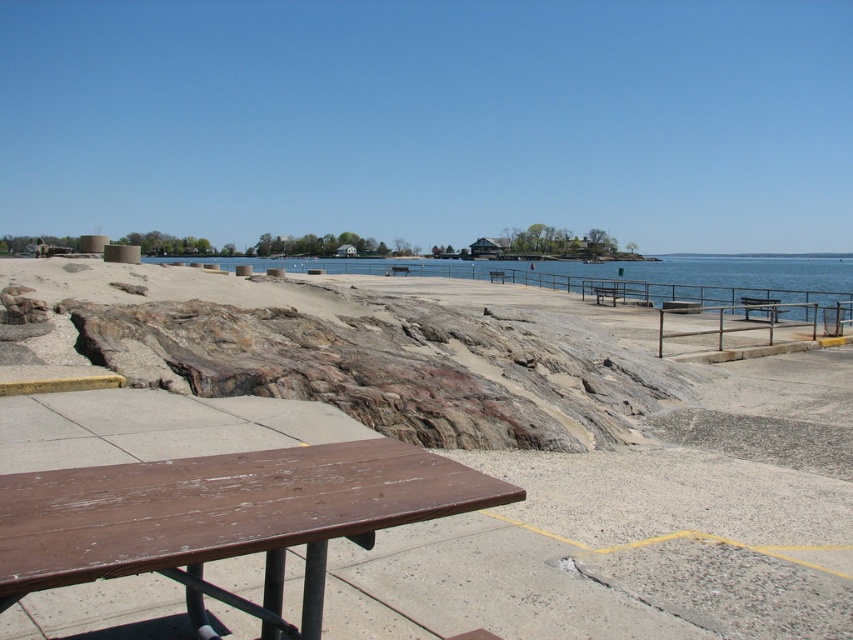
Does wooden picnic table at lower left have a greater width compared to blue water at center?

No.

Does wooden picnic table at lower left appear on the left side of blue water at center?

Indeed, wooden picnic table at lower left is positioned on the left side of blue water at center.

Which is behind, point (368, 456) or point (451, 268)?

Positioned behind is point (451, 268).

Where is `wooden picnic table at lower left`? wooden picnic table at lower left is located at coordinates (225, 518).

Can you confirm if wooden picnic table at lower left is shorter than brown wooden bench at center?

No.

Based on the photo, can you confirm if wooden picnic table at lower left is wider than brown wooden bench at center?

Yes, wooden picnic table at lower left is wider than brown wooden bench at center.

Is point (239, 483) positioned before point (492, 280)?

Yes.

Where is `wooden picnic table at lower left`? Image resolution: width=853 pixels, height=640 pixels. wooden picnic table at lower left is located at coordinates (225, 518).

Does blue water at center have a lesser height compared to brown wooden bench at center?

In fact, blue water at center may be taller than brown wooden bench at center.

Describe the element at coordinates (631, 276) in the screenshot. The width and height of the screenshot is (853, 640). I see `blue water at center` at that location.

Locate an element on the screen. blue water at center is located at coordinates (631, 276).

Find the location of `blue water at center`. blue water at center is located at coordinates (631, 276).